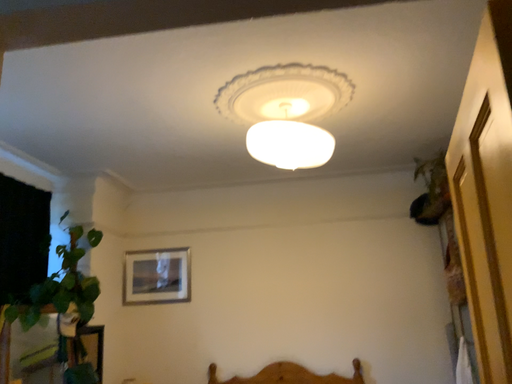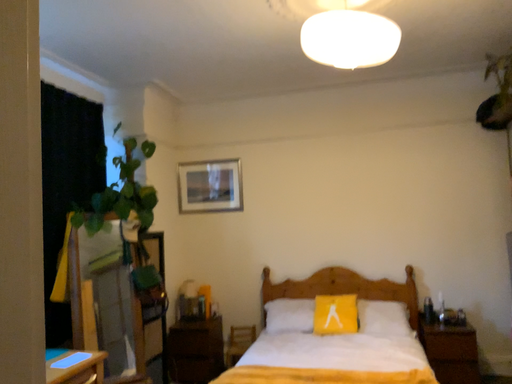
Question: How did the camera likely rotate when shooting the video?

Choices:
 (A) rotated downward
 (B) rotated upward

Answer: (A)